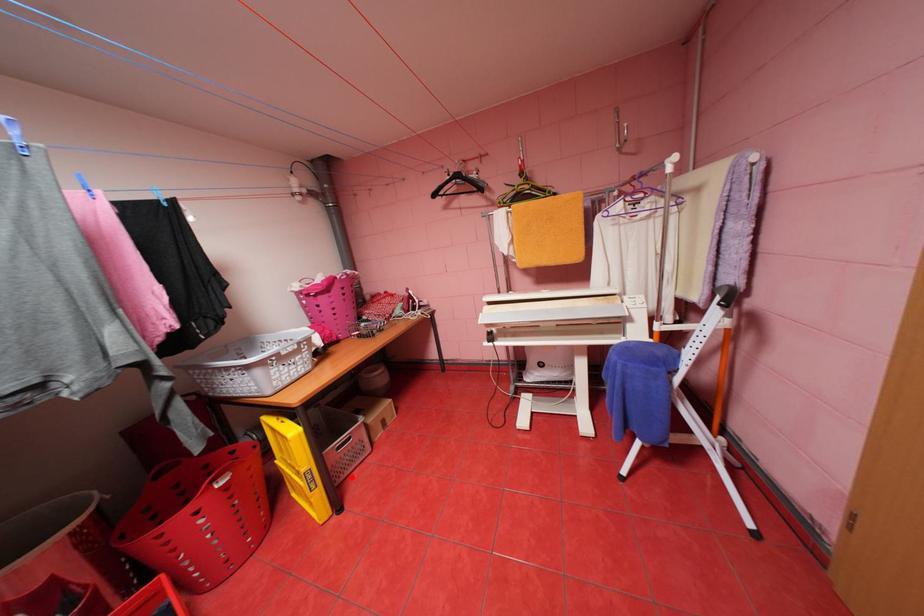
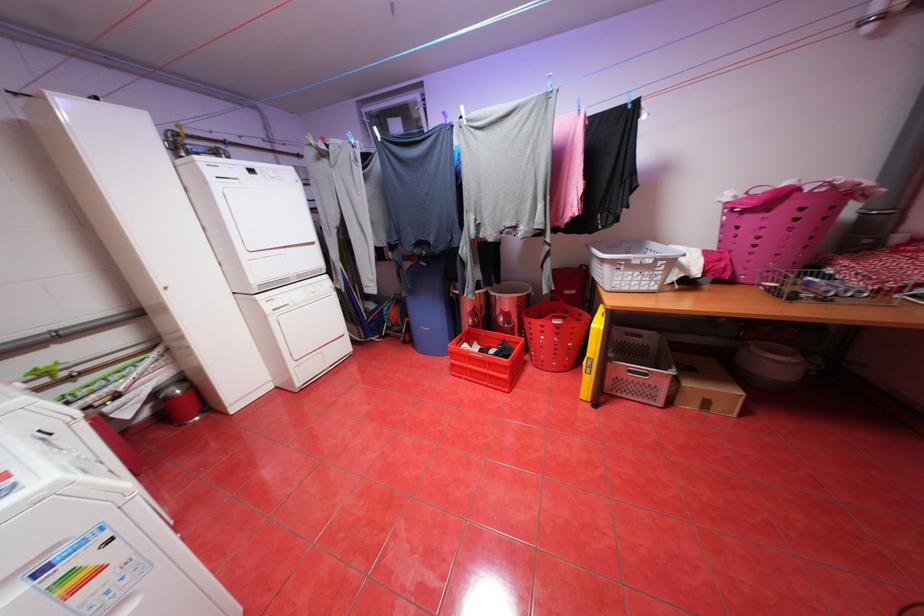
Question: I am providing you with two images of the same scene from different viewpoints. In image1, a red point is highlighted. Considering the same 3D point in image2, which of the following is correct?

Choices:
 (A) It is closer
 (B) It is farther

Answer: (B)